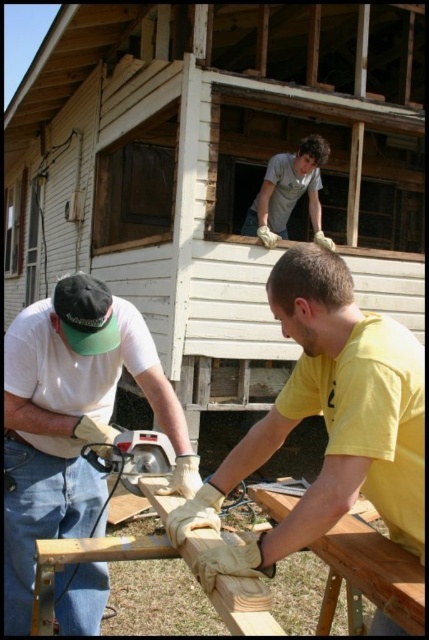
Is point (208, 577) positioned in front of point (287, 195)?

Yes, point (208, 577) is closer to viewer.

Can you confirm if yellow matte shirt at lower right is shorter than light brown wooden plank at upper center?

Incorrect, yellow matte shirt at lower right's height does not fall short of light brown wooden plank at upper center's.

This screenshot has width=429, height=640. In order to click on yellow matte shirt at lower right in this screenshot , I will do `click(329, 420)`.

Locate an element on the screen. The width and height of the screenshot is (429, 640). yellow matte shirt at lower right is located at coordinates (329, 420).

Is point (355, 333) positioned in front of point (100, 444)?

Yes.

Is point (326, 324) positioned in front of point (114, 452)?

That is True.

The width and height of the screenshot is (429, 640). Identify the location of yellow matte shirt at lower right. (329, 420).

Does matte white shirt at left appear over matte gray circular saw at lower left?

No.

Which is behind, point (96, 572) or point (151, 435)?

Positioned behind is point (96, 572).

Measure the distance between matte white shirt at left and camera.

matte white shirt at left and camera are 1.80 meters apart from each other.

Image resolution: width=429 pixels, height=640 pixels. Find the location of `matte white shirt at left`. matte white shirt at left is located at coordinates (71, 420).